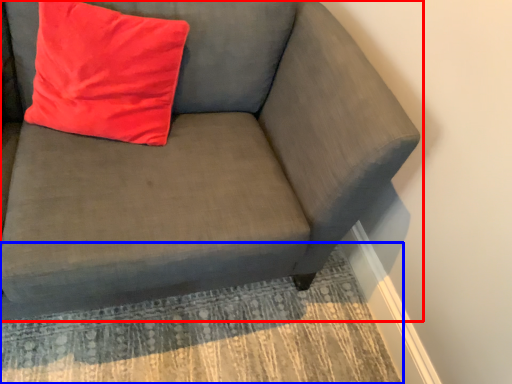
Question: Which point is further to the camera, studio couch (highlighted by a red box) or mat (highlighted by a blue box)?

Choices:
 (A) studio couch
 (B) mat

Answer: (B)